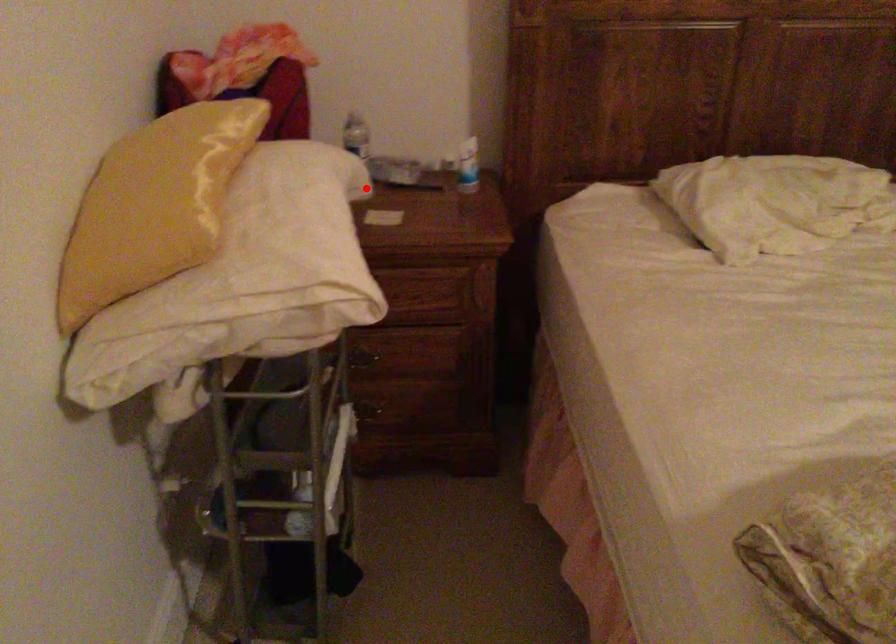
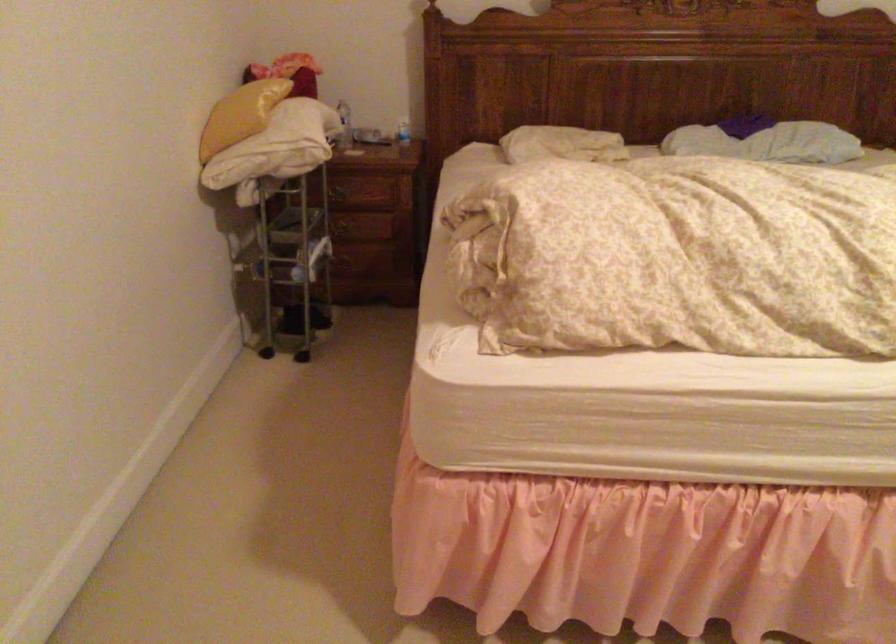
The point at the highlighted location is marked in the first image. Where is the corresponding point in the second image?

(343, 125)